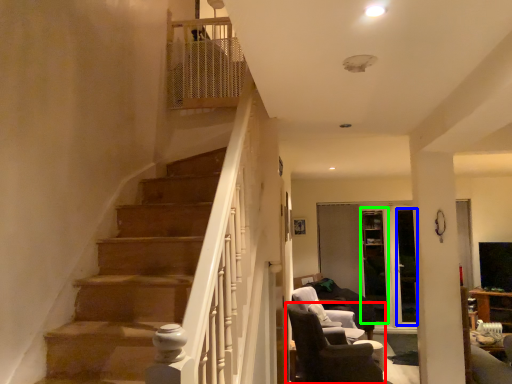
Question: Estimate the real-world distances between objects in this image. Which object is closer to chair (highlighted by a red box), glass door (highlighted by a blue box) or glass door (highlighted by a green box)?

Choices:
 (A) glass door
 (B) glass door

Answer: (B)